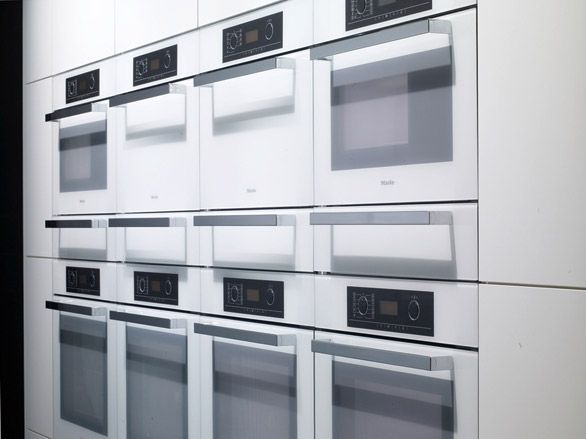
Find the location of a particular element. This screenshot has width=586, height=439. handle is located at coordinates (70, 111), (149, 95), (243, 74), (347, 48), (59, 306), (143, 318), (262, 337), (360, 353).